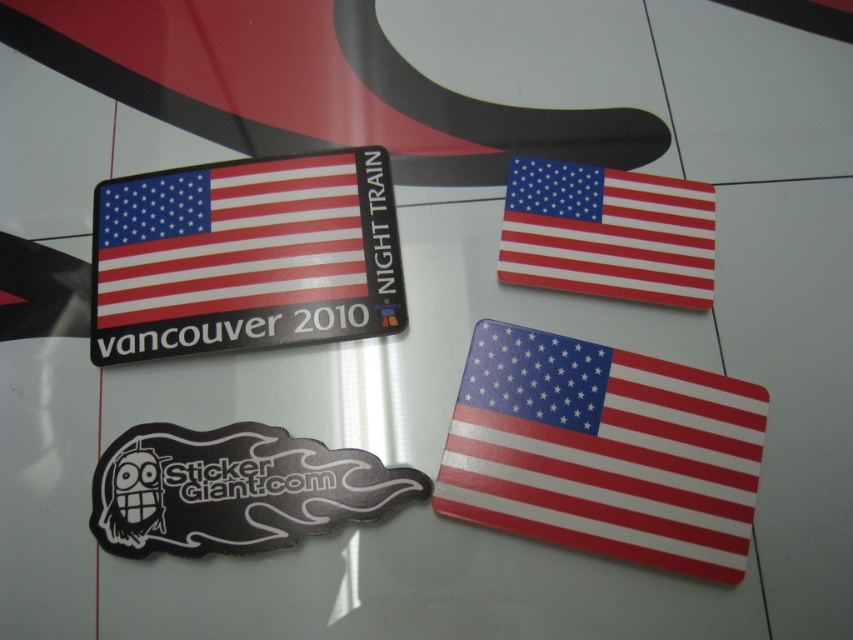
Question: Considering the real-world distances, which object is farthest from the shiny plastic flag at upper right?

Choices:
 (A) black rubber sticker at lower left
 (B) shiny metallic flag at center
 (C) shiny metallic sticker at upper left

Answer: (A)

Question: Among these objects, which one is nearest to the camera?

Choices:
 (A) shiny metallic sticker at upper left
 (B) shiny plastic flag at upper right
 (C) shiny metallic flag at center

Answer: (C)

Question: Does black rubber sticker at lower left have a larger size compared to shiny plastic flag at upper right?

Choices:
 (A) yes
 (B) no

Answer: (B)

Question: Does shiny metallic flag at center have a lesser width compared to shiny metallic sticker at upper left?

Choices:
 (A) yes
 (B) no

Answer: (A)

Question: Does shiny metallic flag at center appear under shiny plastic flag at upper right?

Choices:
 (A) no
 (B) yes

Answer: (B)

Question: Which point is farther from the camera taking this photo?

Choices:
 (A) (335, 465)
 (B) (659, 458)
 (C) (688, 198)
 (D) (347, 243)

Answer: (C)